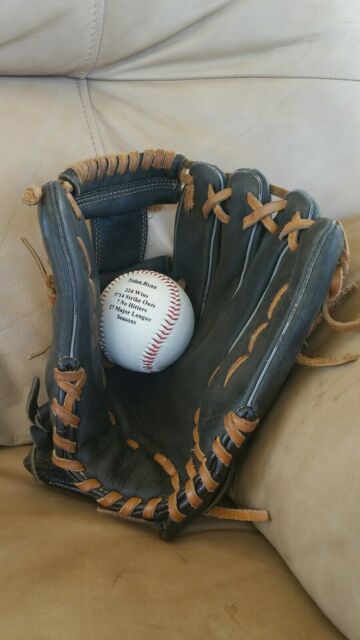
Find the location of a particular element. This screenshot has width=360, height=640. stitching on chair is located at coordinates [x=90, y=132].